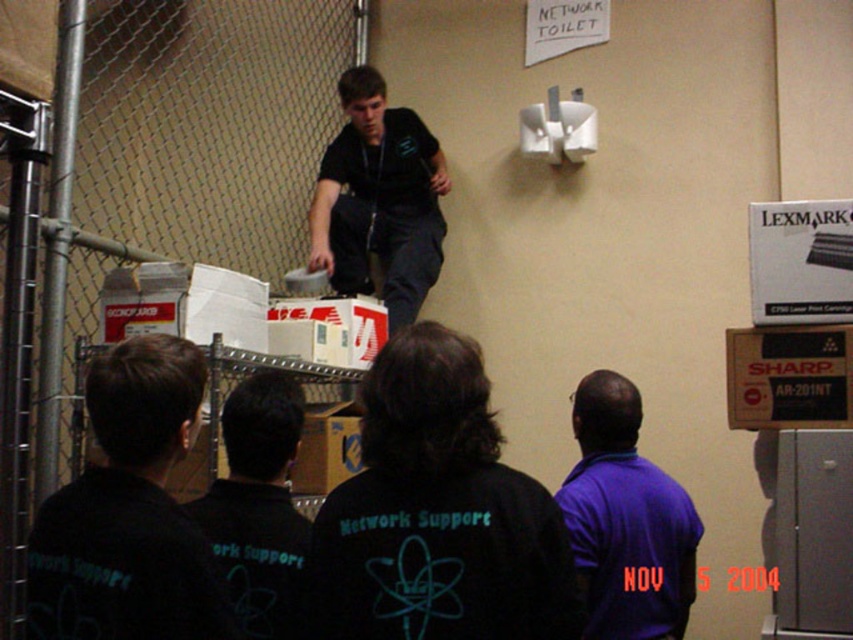
You are part of the Network Support team and need to identify which member is closer to the camera based on their shirts. Which shirt, the black matte shirt at lower left or the purple matte shirt at center, is shorter in height?

The black matte shirt at lower left is shorter than the purple matte shirt at center, so the black matte shirt at lower left is closer to the camera.

You are a security guard in the room and need to locate the person wearing the black matte shirt at lower left. According to the coordinates provided, where should you look to find them?

The black matte shirt at lower left is located at coordinates point (128,513).

You are standing at the center of the image and want to locate the black matte shirt at lower left. In which direction should you look to find it?

You should look to the lower left direction to find the black matte shirt at lower left since it is located at point [128,513].